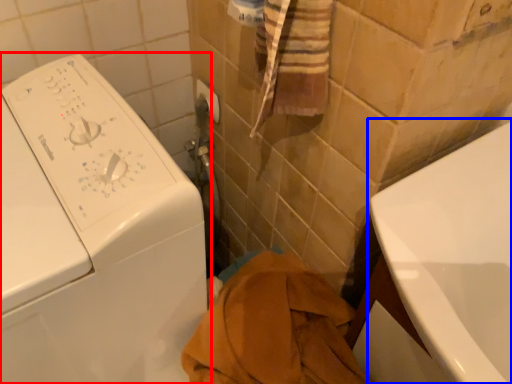
Question: Which object appears closest to the camera in this image, washing machine (highlighted by a red box) or bath (highlighted by a blue box)?

Choices:
 (A) washing machine
 (B) bath

Answer: (A)